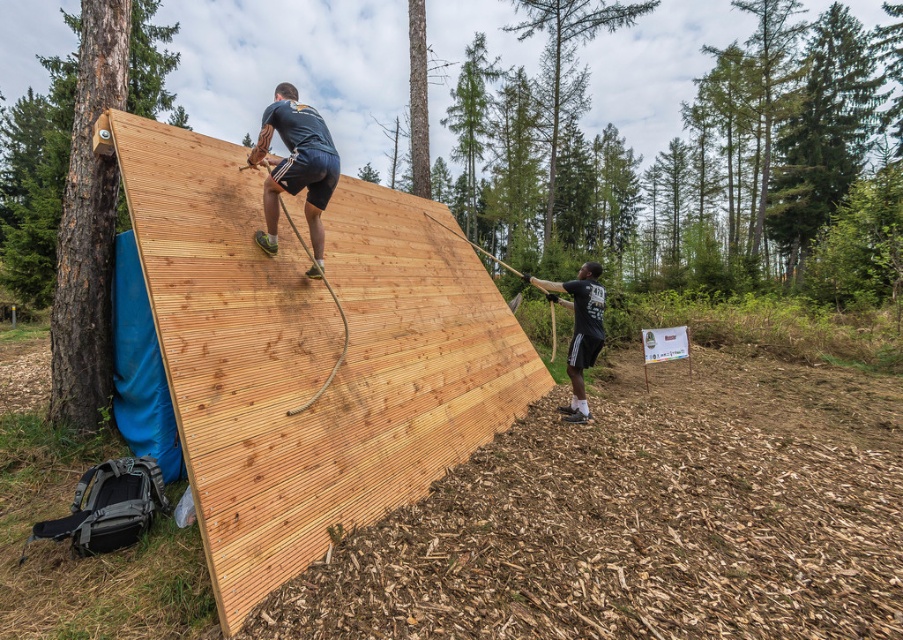
Is natural wood plywood at upper center taller than dark blue fabric at upper center?

Yes, natural wood plywood at upper center is taller than dark blue fabric at upper center.

This screenshot has height=640, width=903. Describe the element at coordinates (310, 355) in the screenshot. I see `natural wood plywood at upper center` at that location.

At what (x,y) coordinates should I click in order to perform the action: click on natural wood plywood at upper center. Please return your answer as a coordinate pair (x, y). The height and width of the screenshot is (640, 903). Looking at the image, I should click on (310, 355).

Can you confirm if natural wood plywood at upper center is positioned below green smooth bark tree at upper center?

Indeed, natural wood plywood at upper center is positioned under green smooth bark tree at upper center.

The height and width of the screenshot is (640, 903). What do you see at coordinates (310, 355) in the screenshot?
I see `natural wood plywood at upper center` at bounding box center [310, 355].

Who is more distant from viewer, [450,218] or [607,19]?

The point [607,19] is behind.

Where is `natural wood plywood at upper center`? This screenshot has width=903, height=640. natural wood plywood at upper center is located at coordinates (310, 355).

Describe the element at coordinates (566, 44) in the screenshot. I see `green smooth bark tree at upper center` at that location.

Is point (554, 100) behind point (571, 282)?

Yes, point (554, 100) is farther from viewer.

Identify the location of green smooth bark tree at upper center. (566, 44).